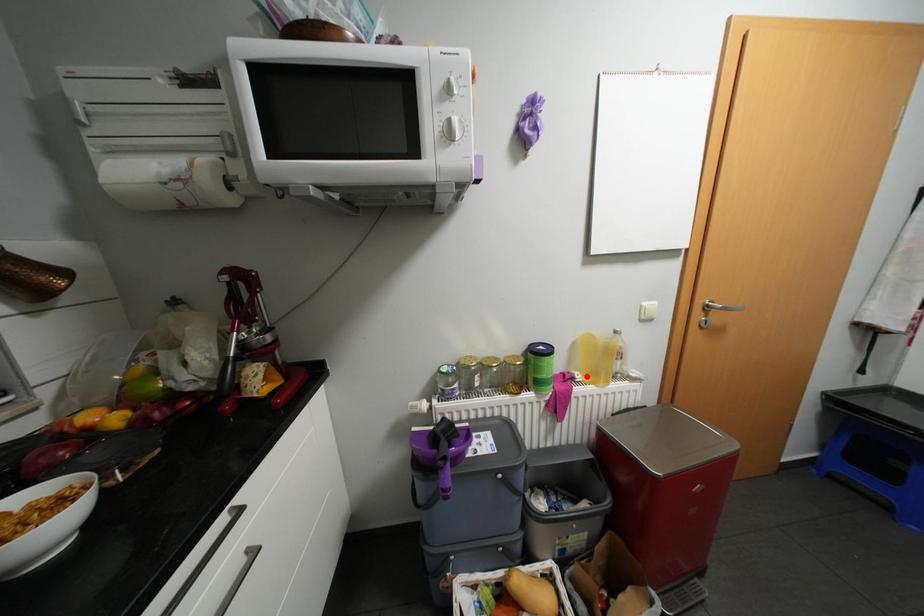
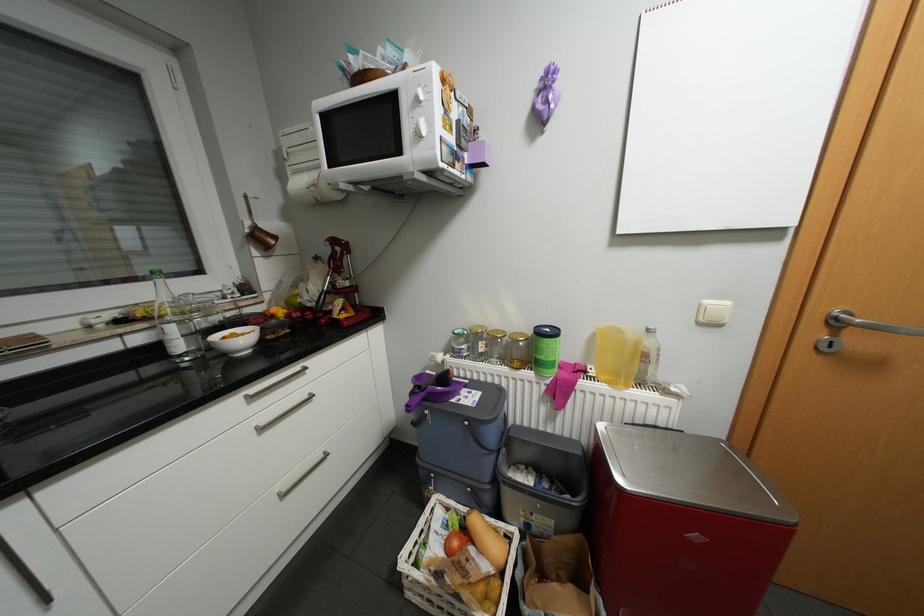
Where in the second image is the point corresponding to the highlighted location from the first image?

(600, 371)